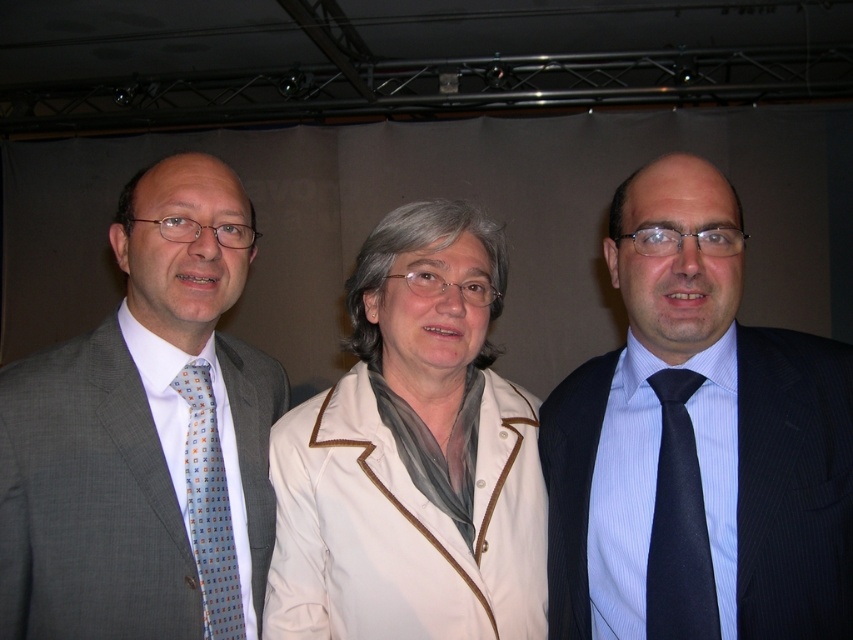
You are a photographer setting up for a group photo. You need to ensure that the gray textured suit at left and the light blue printed tie at left are both visible in the frame. Given their sizes, which one might require you to adjust the camera angle to include it properly?

The gray textured suit at left is much taller than the light blue printed tie at left, so the camera angle might need to be adjusted to accommodate its larger size to ensure both are fully visible.

You are a photographer adjusting the camera focus. The gray textured suit at left and the light blue printed tie at left are in your viewfinder. Which object is closer to the camera lens?

The gray textured suit at left is closer to the camera lens because it is only 4.06 inches away from the light blue printed tie at left, which implies the suit is nearer to the lens than the tie.

You are a photographer setting up for a group photo. You notice the gray textured suit at left and the light blue printed tie at left in your frame. Which object is closer to the camera?

The gray textured suit at left is closer to the camera because it is in front of the light blue printed tie at left.